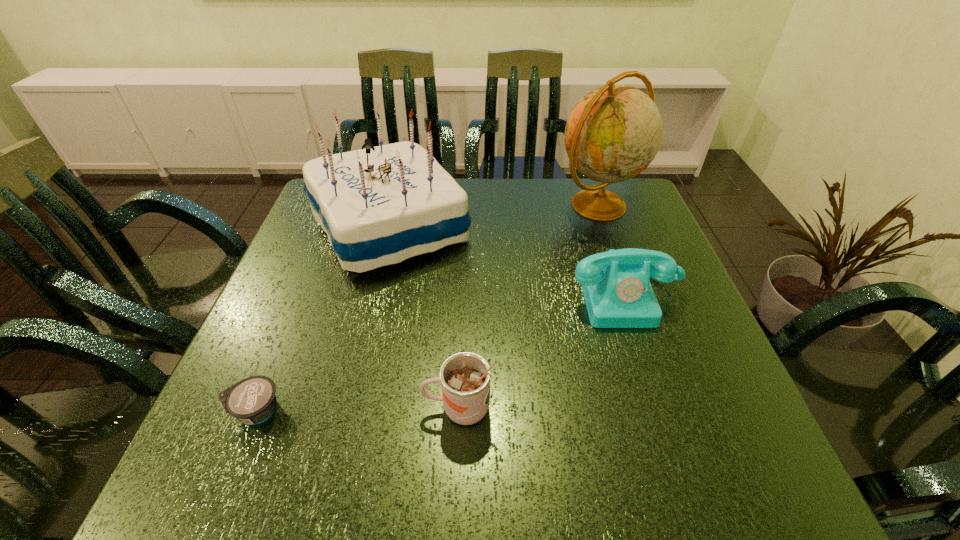
The width and height of the screenshot is (960, 540). What are the coordinates of `globe` in the screenshot? It's located at (613, 133).

The image size is (960, 540). I want to click on birthday cake, so click(x=381, y=205).

The width and height of the screenshot is (960, 540). Identify the location of telephone. (616, 286).

Image resolution: width=960 pixels, height=540 pixels. What are the coordinates of `cup` in the screenshot? It's located at (465, 377).

Where is `yogurt`? The image size is (960, 540). yogurt is located at coordinates (252, 400).

Where is `vacant area situated 0.210m on the left of the globe`? Image resolution: width=960 pixels, height=540 pixels. vacant area situated 0.210m on the left of the globe is located at coordinates (479, 206).

Locate an element on the screen. The width and height of the screenshot is (960, 540). vacant space located 0.340m on the right of the fourth shortest object is located at coordinates (604, 228).

Image resolution: width=960 pixels, height=540 pixels. What are the coordinates of `vacant position located 0.290m on the dial of the telephone` in the screenshot? It's located at (684, 472).

Where is `blank area located 0.090m on the side with the handle of the cup`? blank area located 0.090m on the side with the handle of the cup is located at coordinates (371, 408).

At what (x,y) coordinates should I click in order to perform the action: click on free space located on the side with the handle of the cup. Please return your answer as a coordinate pair (x, y). Image resolution: width=960 pixels, height=540 pixels. Looking at the image, I should click on (336, 408).